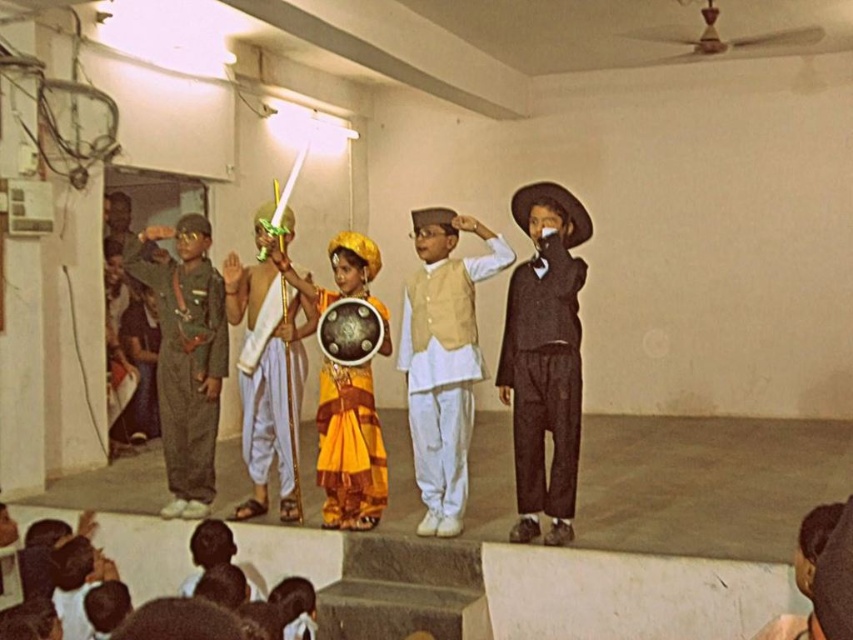
Which is below, yellow silk sari at center or white silk dhoti at center?

Positioned lower is yellow silk sari at center.

What do you see at coordinates (349, 449) in the screenshot? The height and width of the screenshot is (640, 853). I see `yellow silk sari at center` at bounding box center [349, 449].

You are a GUI agent. You are given a task and a screenshot of the screen. Output one action in this format:
    pyautogui.click(x=<x>, y=<y>)
    Task: Click on the yellow silk sari at center
    This screenshot has height=640, width=853.
    Given the screenshot: What is the action you would take?
    pyautogui.click(x=349, y=449)

Can you confirm if white cotton kurta at center is positioned below green fabric uniform at left?

Yes.

Is the position of white cotton kurta at center less distant than that of green fabric uniform at left?

Yes.

What do you see at coordinates (444, 364) in the screenshot? This screenshot has width=853, height=640. I see `white cotton kurta at center` at bounding box center [444, 364].

Find the location of a particular element. The image size is (853, 640). white cotton kurta at center is located at coordinates (444, 364).

Is white cotton kurta at center further to the viewer compared to yellow silk sari at center?

No, white cotton kurta at center is closer to the viewer.

Image resolution: width=853 pixels, height=640 pixels. What do you see at coordinates (444, 364) in the screenshot?
I see `white cotton kurta at center` at bounding box center [444, 364].

You are a GUI agent. You are given a task and a screenshot of the screen. Output one action in this format:
    pyautogui.click(x=<x>, y=<y>)
    Task: Click on the white cotton kurta at center
    The image size is (853, 640).
    Given the screenshot: What is the action you would take?
    pyautogui.click(x=444, y=364)